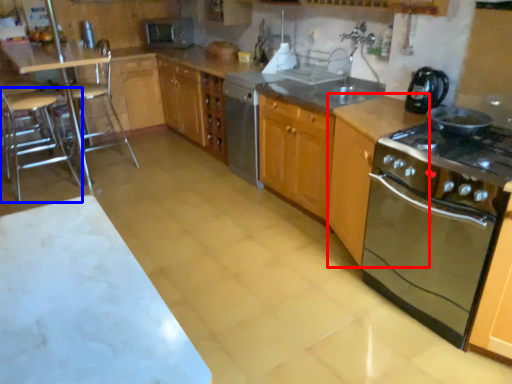
Question: Which of the following is the closest to the observer, cabinetry (highlighted by a red box) or bar stool (highlighted by a blue box)?

Choices:
 (A) cabinetry
 (B) bar stool

Answer: (A)